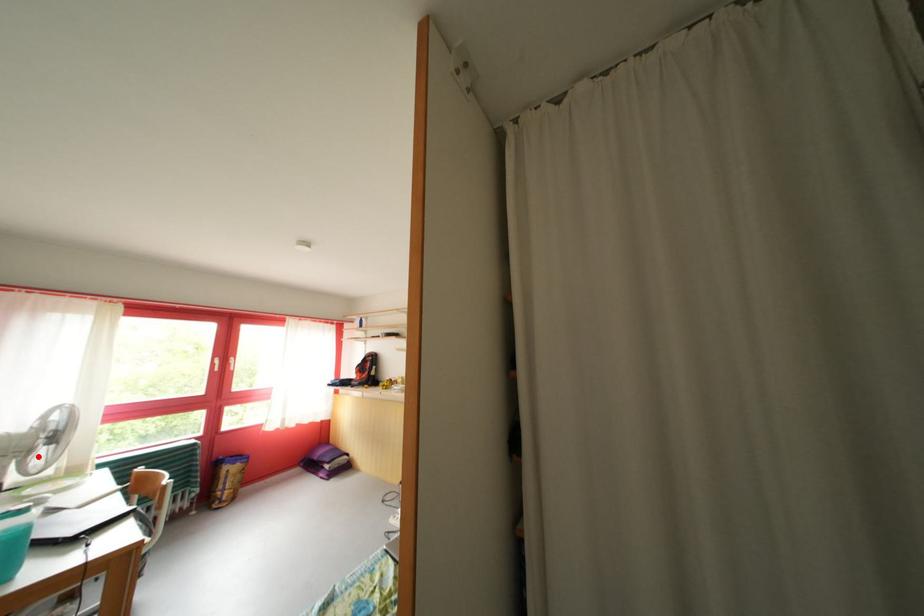
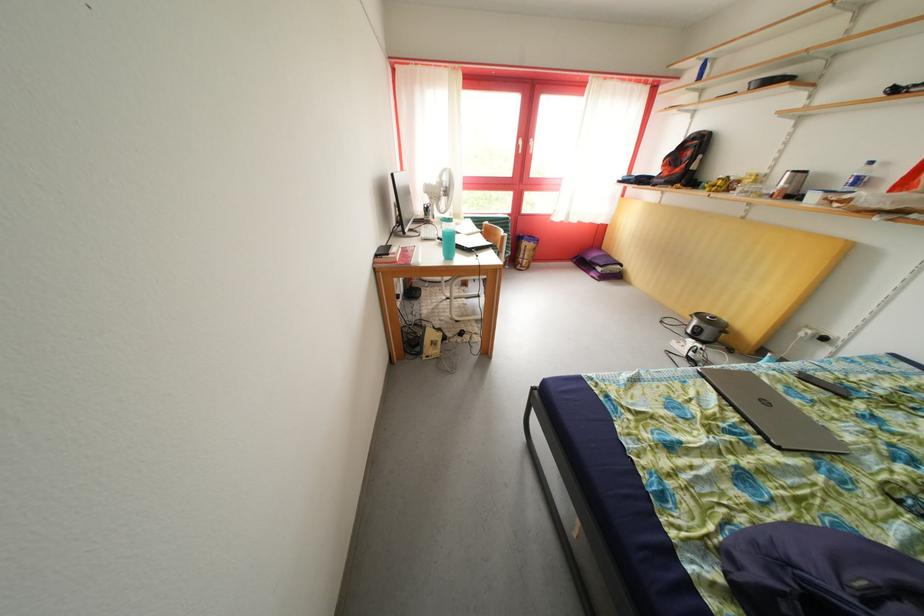
Question: I am providing you with two images of the same scene from different viewpoints. A red point is shown in image1. For the corresponding object point in image2, is it positioned nearer or farther from the camera?

Choices:
 (A) Nearer
 (B) Farther

Answer: (B)